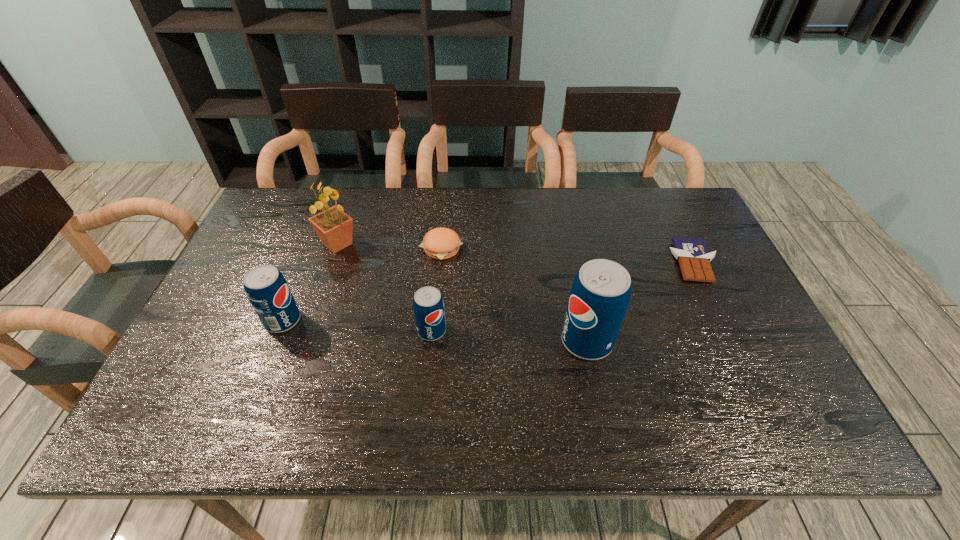
In the image, there is a desktop. Identify the location of vacant space at the far edge. This screenshot has height=540, width=960. (390, 219).

In the image, there is a desktop. Identify the location of vacant area at the near edge. (308, 379).

You are a GUI agent. You are given a task and a screenshot of the screen. Output one action in this format:
    pyautogui.click(x=<x>, y=<y>)
    Task: Click on the vacant space at the left edge of the desktop
    Image resolution: width=960 pixels, height=540 pixels.
    Given the screenshot: What is the action you would take?
    pyautogui.click(x=243, y=313)

I want to click on free space at the right edge, so click(665, 241).

The image size is (960, 540). What are the coordinates of `free space at the far right corner of the desktop` in the screenshot? It's located at (662, 199).

Where is `vacant area that lies between the sunflower and the rightmost object`? This screenshot has width=960, height=540. vacant area that lies between the sunflower and the rightmost object is located at coordinates (516, 253).

Locate an element on the screen. This screenshot has width=960, height=540. vacant area that lies between the chocolate bar and the sunflower is located at coordinates (516, 253).

Find the location of a particular element. Image resolution: width=960 pixels, height=540 pixels. blank region between the sunflower and the third shortest object is located at coordinates (385, 287).

I want to click on blank region between the shortest pop and the third tallest object, so click(357, 326).

Where is `free space between the patty and the leftmost pop`? The image size is (960, 540). free space between the patty and the leftmost pop is located at coordinates (362, 285).